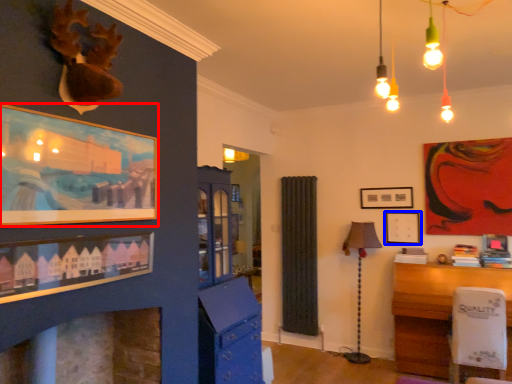
Question: Which object appears closest to the camera in this image, picture frame (highlighted by a red box) or picture frame (highlighted by a blue box)?

Choices:
 (A) picture frame
 (B) picture frame

Answer: (A)